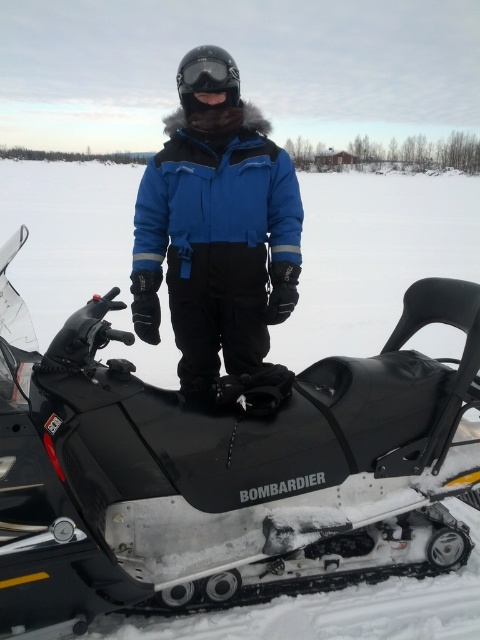
Question: Among these objects, which one is nearest to the camera?

Choices:
 (A) black matte goggles at center
 (B) blue synthetic jacket at center
 (C) black matte snowmobile at center

Answer: (C)

Question: Which point is closer to the camera?

Choices:
 (A) blue synthetic jacket at center
 (B) black matte goggles at center
 (C) black matte snowmobile at center

Answer: (C)

Question: Is blue synthetic jacket at center below black matte goggles at center?

Choices:
 (A) no
 (B) yes

Answer: (B)

Question: Does blue synthetic jacket at center have a smaller size compared to black matte goggles at center?

Choices:
 (A) yes
 (B) no

Answer: (A)

Question: Does blue synthetic jacket at center have a lesser width compared to black matte goggles at center?

Choices:
 (A) no
 (B) yes

Answer: (B)

Question: Which point is farther to the camera?

Choices:
 (A) tap(197, 198)
 (B) tap(117, 582)
 (C) tap(228, 84)

Answer: (A)